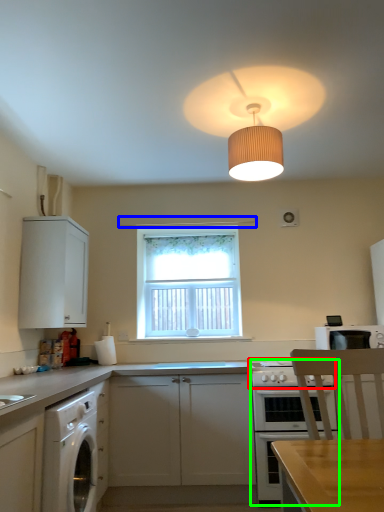
Question: Based on their relative distances, which object is nearer to gas stove (highlighted by a red box)? Choose from exhaust hood (highlighted by a blue box) and oven (highlighted by a green box).

Choices:
 (A) exhaust hood
 (B) oven

Answer: (B)